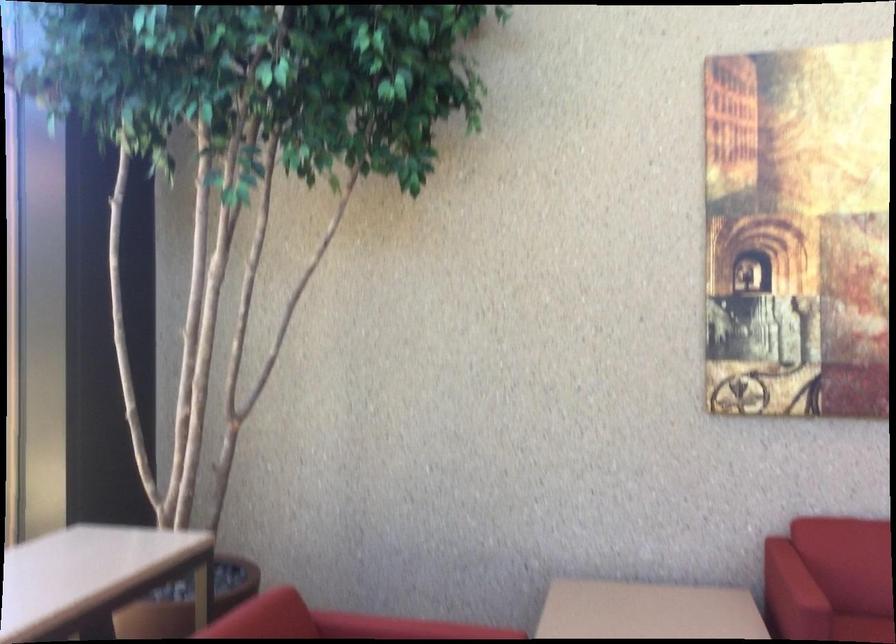
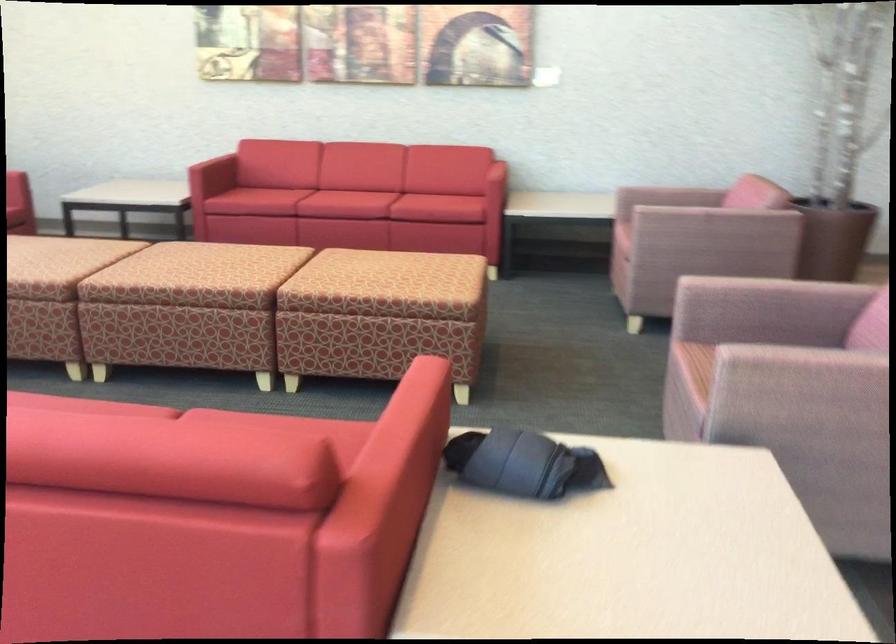
The images are taken continuously from a first-person perspective. In which direction are you moving?

The movement direction of the cameraman is right, backward.